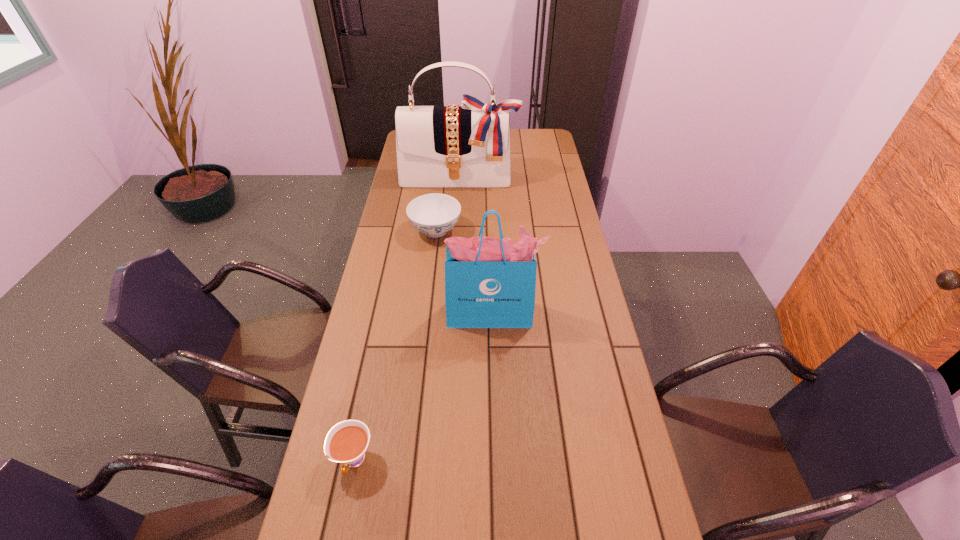
You are a GUI agent. You are given a task and a screenshot of the screen. Output one action in this format:
    pyautogui.click(x=<x>, y=<y>)
    Task: Click on the vacant region between the chinaware and the nearest object
    
    Given the screenshot: What is the action you would take?
    pyautogui.click(x=395, y=346)

Identify the location of empty space between the nearest object and the tallest object. (406, 319).

This screenshot has height=540, width=960. I want to click on object that stands as the second closest to the teacup, so click(434, 214).

The width and height of the screenshot is (960, 540). I want to click on the closest object to the second shortest object, so click(x=469, y=145).

You are a GUI agent. You are given a task and a screenshot of the screen. Output one action in this format:
    pyautogui.click(x=<x>, y=<y>)
    Task: Click on the vacant space that satisfies the following two spatial constraints: 1. on the front-facing side of the tallest object; 2. on the left side of the shopping bag
    The width and height of the screenshot is (960, 540).
    Given the screenshot: What is the action you would take?
    pyautogui.click(x=450, y=314)